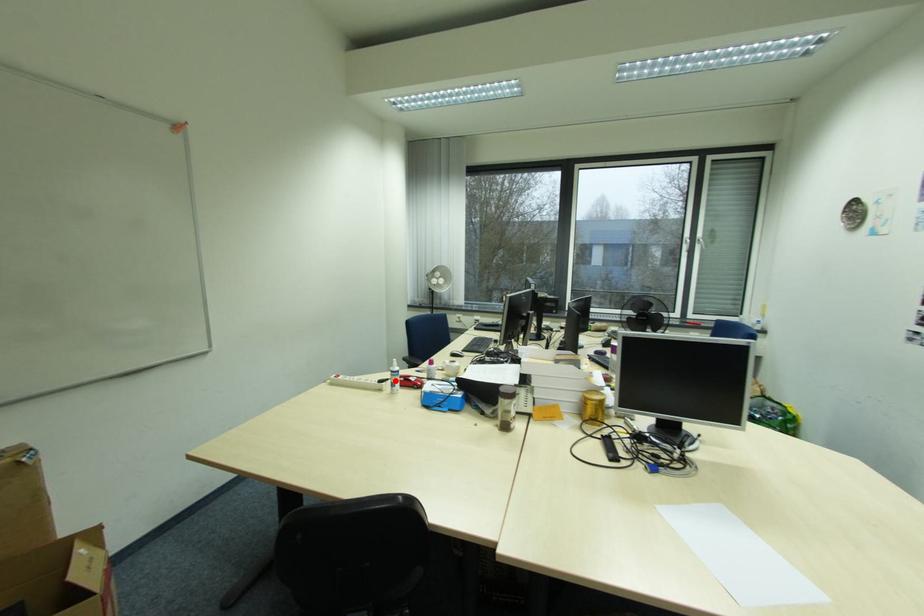
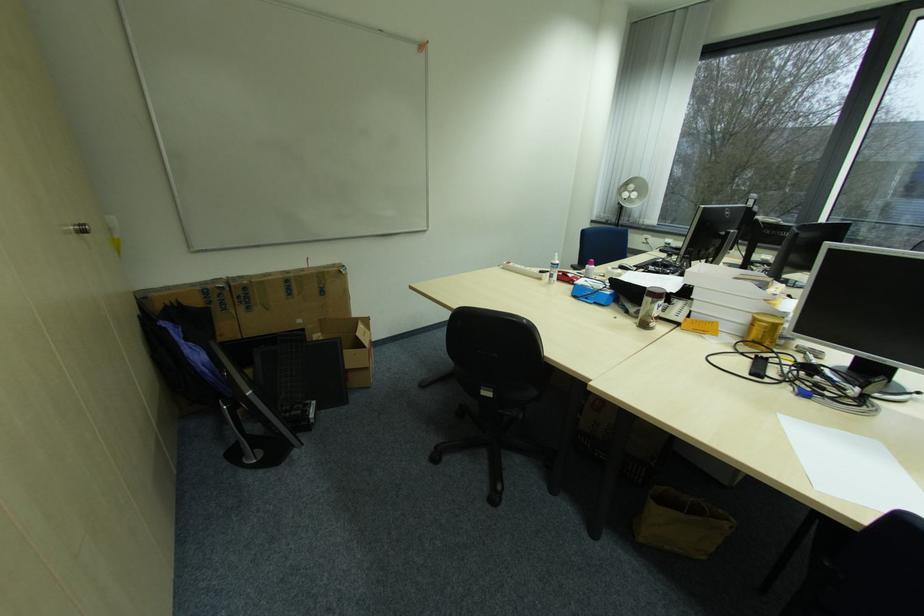
The point at the highlighted location is marked in the first image. Where is the corresponding point in the second image?

(555, 273)